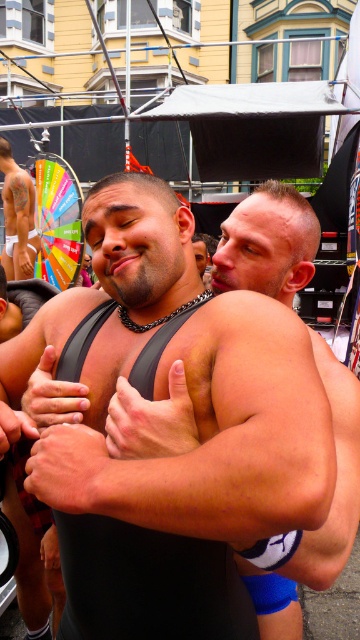
Question: Can you confirm if black matte singlet at center is positioned above white skin tattooed man at left?

Choices:
 (A) no
 (B) yes

Answer: (A)

Question: Can you confirm if black matte singlet at center is positioned to the right of blue fabric shorts at center?

Choices:
 (A) no
 (B) yes

Answer: (A)

Question: Which object appears farthest from the camera in this image?

Choices:
 (A) black matte singlet at center
 (B) black matte arm at center
 (C) white skin tattooed man at left

Answer: (C)

Question: Which object is closer to the camera taking this photo?

Choices:
 (A) black matte arm at center
 (B) white skin tattooed man at left
 (C) blue fabric shorts at center
 (D) black matte singlet at center

Answer: (A)

Question: Observing the image, what is the correct spatial positioning of black matte singlet at center in reference to black matte arm at center?

Choices:
 (A) below
 (B) above

Answer: (B)

Question: Among these points, which one is nearest to the camera?

Choices:
 (A) (65, 504)
 (B) (29, 227)
 (C) (24, 428)

Answer: (A)